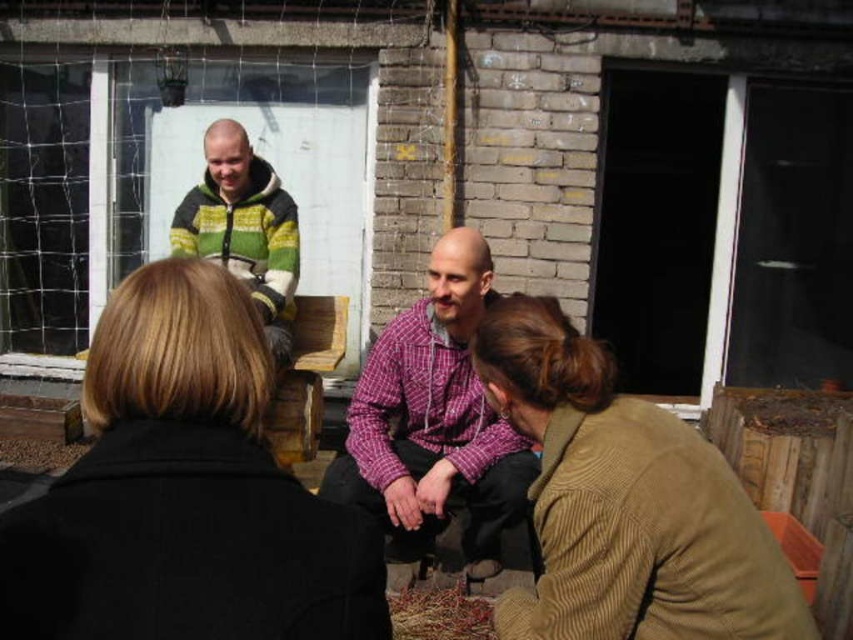
You are standing at the origin point of the coordinate system in the image. You want to move towards the brown corduroy jacket at lower right. What direction should you move in to reach it?

Since the brown corduroy jacket at lower right is located at coordinate point (x=624, y=502), you should move towards the lower right direction to reach it.

You are standing in the outdoor gathering area shown in the image. You need to locate the black wool coat at center. Where exactly is it located in terms of coordinates?

The black wool coat at center is located at coordinates point [184,492].